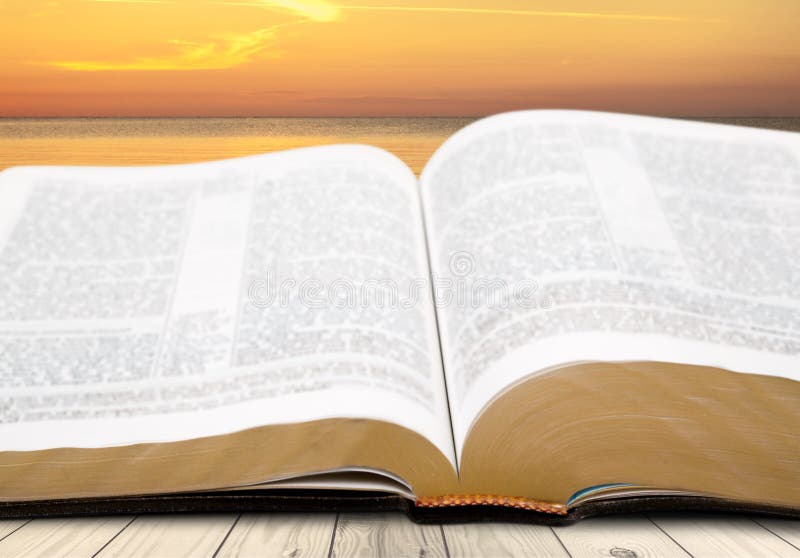
Where is `book`? The height and width of the screenshot is (558, 800). book is located at coordinates (480, 401).